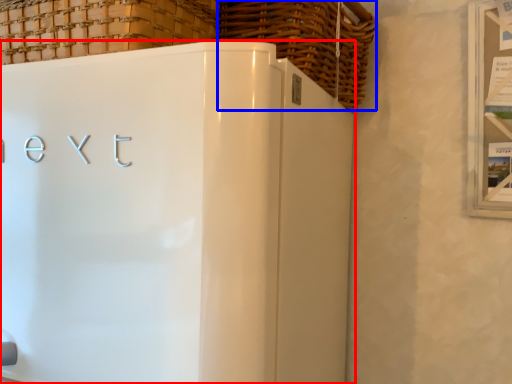
Question: Among these objects, which one is farthest to the camera, refrigerator (highlighted by a red box) or basket (highlighted by a blue box)?

Choices:
 (A) refrigerator
 (B) basket

Answer: (B)